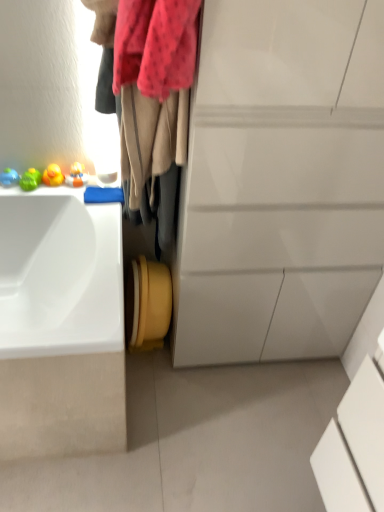
Question: From the image's perspective, is white glossy sink at left located above velvet beige scarf at upper left?

Choices:
 (A) yes
 (B) no

Answer: (B)

Question: From a real-world perspective, is white glossy sink at left on top of velvet beige scarf at upper left?

Choices:
 (A) no
 (B) yes

Answer: (A)

Question: Can you confirm if white glossy sink at left is taller than velvet beige scarf at upper left?

Choices:
 (A) yes
 (B) no

Answer: (B)

Question: Is white glossy sink at left smaller than velvet beige scarf at upper left?

Choices:
 (A) no
 (B) yes

Answer: (A)

Question: Considering the relative sizes of white glossy sink at left and velvet beige scarf at upper left in the image provided, is white glossy sink at left thinner than velvet beige scarf at upper left?

Choices:
 (A) yes
 (B) no

Answer: (B)

Question: Is white glossy cabinet at center to the left or to the right of white glossy sink at left in the image?

Choices:
 (A) left
 (B) right

Answer: (B)

Question: In terms of width, does white glossy cabinet at center look wider or thinner when compared to white glossy sink at left?

Choices:
 (A) thin
 (B) wide

Answer: (A)

Question: From a real-world perspective, is white glossy cabinet at center above or below white glossy sink at left?

Choices:
 (A) above
 (B) below

Answer: (A)

Question: From the image's perspective, is white glossy cabinet at center above or below white glossy sink at left?

Choices:
 (A) below
 (B) above

Answer: (B)

Question: Looking at their shapes, would you say velvet beige scarf at upper left is wider or thinner than white glossy cabinet at center?

Choices:
 (A) wide
 (B) thin

Answer: (B)

Question: Is point [178, 161] closer or farther from the camera than point [344, 219]?

Choices:
 (A) farther
 (B) closer

Answer: (B)

Question: From the image's perspective, is velvet beige scarf at upper left above or below white glossy cabinet at center?

Choices:
 (A) above
 (B) below

Answer: (A)

Question: Is velvet beige scarf at upper left situated inside white glossy cabinet at center or outside?

Choices:
 (A) outside
 (B) inside

Answer: (A)

Question: Would you say white glossy cabinet at center is to the left or to the right of velvet beige scarf at upper left in the picture?

Choices:
 (A) right
 (B) left

Answer: (A)

Question: From a real-world perspective, relative to velvet beige scarf at upper left, is white glossy cabinet at center vertically above or below?

Choices:
 (A) below
 (B) above

Answer: (A)